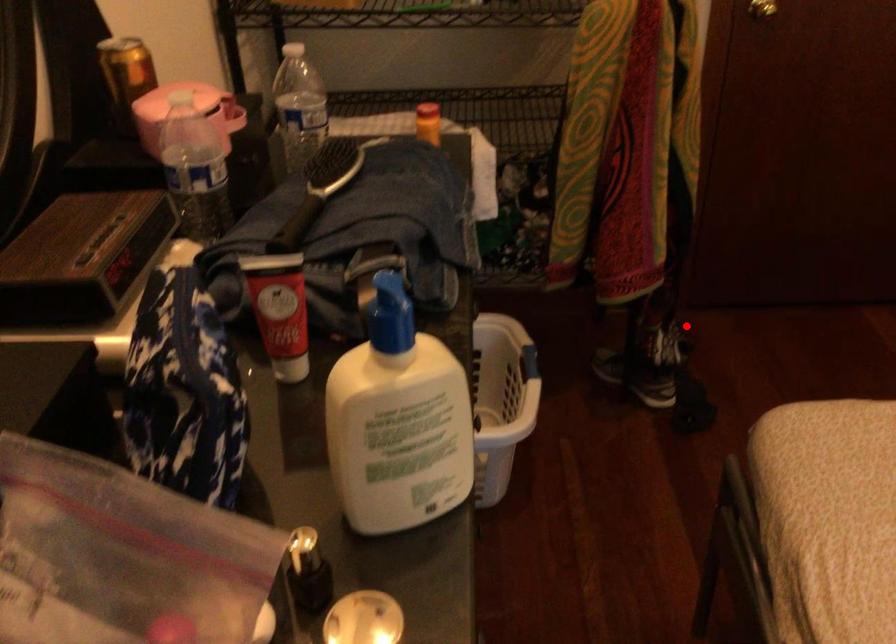
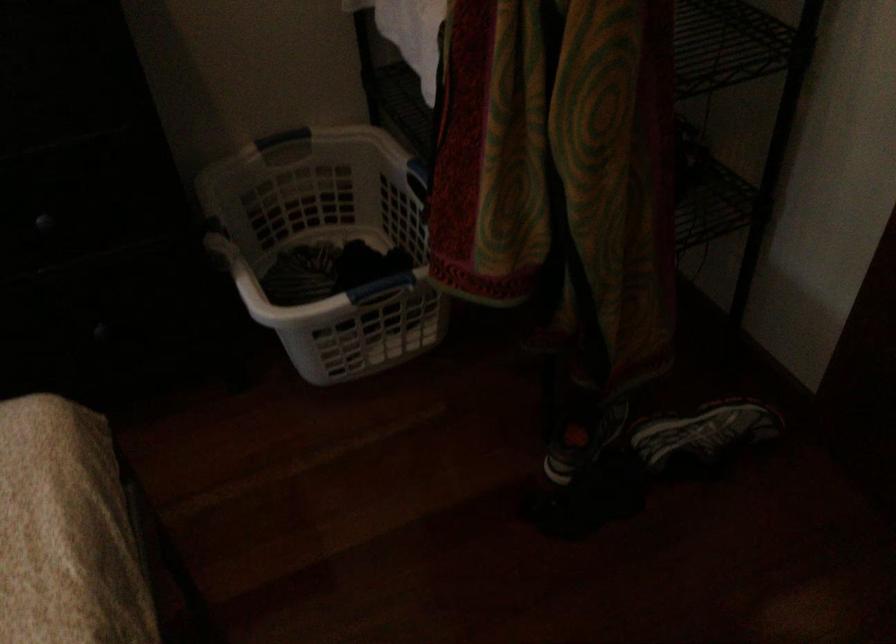
Find the pixel in the second image that matches the highlighted location in the first image.

(702, 436)